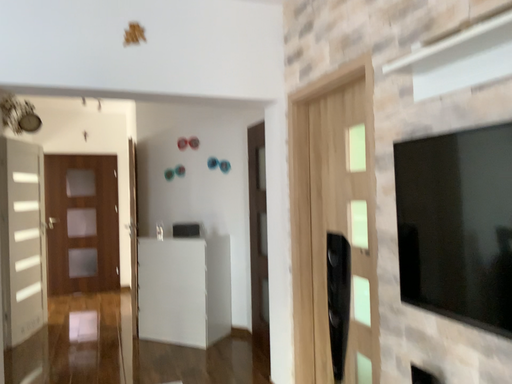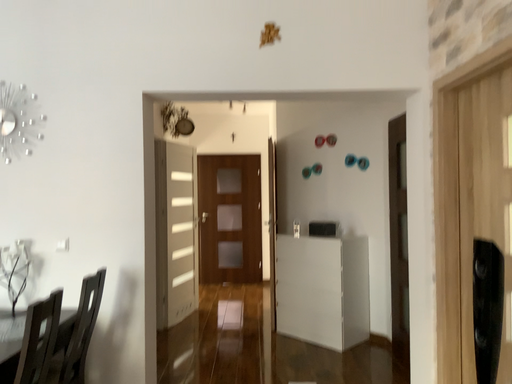
Question: Which way did the camera rotate in the video?

Choices:
 (A) rotated left
 (B) rotated right

Answer: (A)